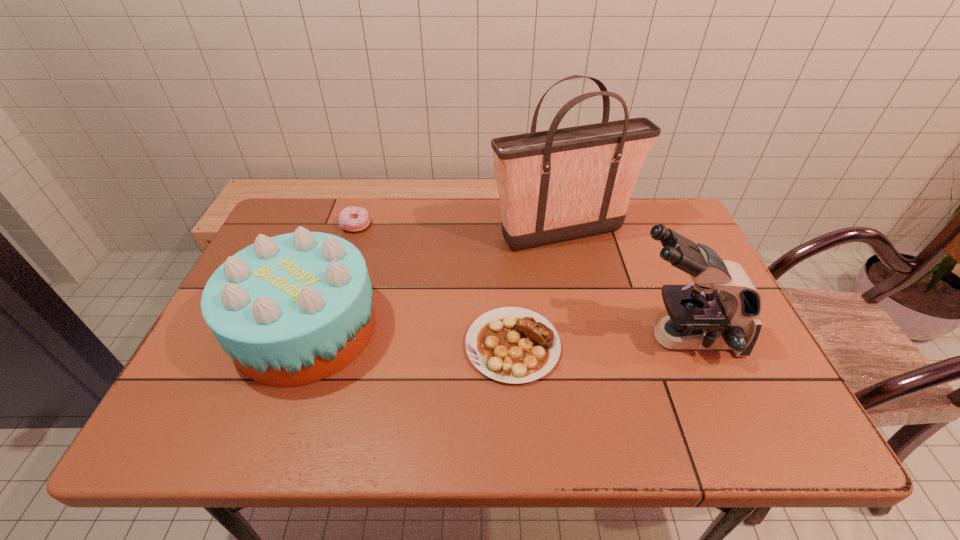
Identify the location of shopping bag. (557, 185).

This screenshot has width=960, height=540. I want to click on microscope, so click(x=700, y=317).

I want to click on cake, so (x=293, y=309).

Locate an element on the screen. doughnut is located at coordinates (353, 219).

What are the coordinates of `steak` in the screenshot? It's located at (514, 345).

The height and width of the screenshot is (540, 960). I want to click on vacant point located on the left of the shopping bag, so click(386, 234).

Identify the location of free space located through the eyepieces of the microscope. The width and height of the screenshot is (960, 540). (488, 338).

At what (x,y) coordinates should I click in order to perform the action: click on vacant space located through the eyepieces of the microscope. Please return your answer as a coordinate pair (x, y). The width and height of the screenshot is (960, 540). Looking at the image, I should click on (551, 338).

The height and width of the screenshot is (540, 960). Identify the location of vacant space situated through the eyepieces of the microscope. (492, 338).

Locate an element on the screen. The height and width of the screenshot is (540, 960). vacant area located on the right of the third tallest object is located at coordinates (444, 328).